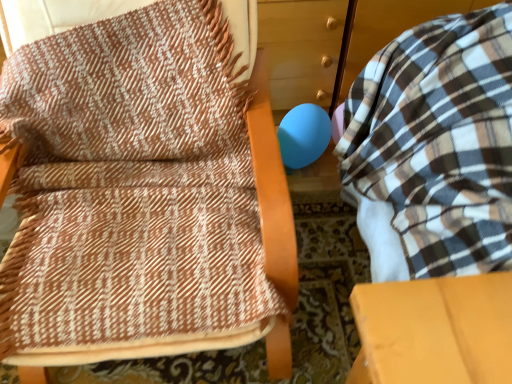
The width and height of the screenshot is (512, 384). Identify the location of matte blue balloon at center. (303, 135).

Identify the location of brown woven blanket at upper left. (143, 193).

Image resolution: width=512 pixels, height=384 pixels. What do you see at coordinates (143, 193) in the screenshot?
I see `brown woven blanket at upper left` at bounding box center [143, 193].

Where is `matte blue balloon at center`? Image resolution: width=512 pixels, height=384 pixels. matte blue balloon at center is located at coordinates (303, 135).

Can you tell me how much brown woven blanket at upper left and plaid fabric bean bag at right differ in facing direction?

The angle between the facing direction of brown woven blanket at upper left and the facing direction of plaid fabric bean bag at right is 90.4 degrees.

Does brown woven blanket at upper left appear on the left side of plaid fabric bean bag at right?

Correct, you'll find brown woven blanket at upper left to the left of plaid fabric bean bag at right.

Is brown woven blanket at upper left aimed at plaid fabric bean bag at right?

No.

In the scene shown: Is brown woven blanket at upper left far from matte blue balloon at center?

No, brown woven blanket at upper left is in close proximity to matte blue balloon at center.

Which object is positioned more to the right, brown woven blanket at upper left or matte blue balloon at center?

From the viewer's perspective, matte blue balloon at center appears more on the right side.

Is brown woven blanket at upper left oriented away from matte blue balloon at center?

No, brown woven blanket at upper left is not facing the opposite direction of matte blue balloon at center.

The image size is (512, 384). I want to click on balloon on the left of plaid fabric bean bag at right, so click(x=303, y=135).

Which object is positioned more to the left, matte blue balloon at center or plaid fabric bean bag at right?

From the viewer's perspective, matte blue balloon at center appears more on the left side.

Considering the relative sizes of matte blue balloon at center and plaid fabric bean bag at right in the image provided, is matte blue balloon at center wider than plaid fabric bean bag at right?

Incorrect, the width of matte blue balloon at center does not surpass that of plaid fabric bean bag at right.

Does matte blue balloon at center touch plaid fabric bean bag at right?

There is a gap between matte blue balloon at center and plaid fabric bean bag at right.

Is plaid fabric bean bag at right to the right of brown woven blanket at upper left from the viewer's perspective?

Yes, plaid fabric bean bag at right is to the right of brown woven blanket at upper left.

Considering the sizes of objects plaid fabric bean bag at right and brown woven blanket at upper left in the image provided, who is smaller, plaid fabric bean bag at right or brown woven blanket at upper left?

Smaller between the two is brown woven blanket at upper left.

From the image's perspective, does plaid fabric bean bag at right appear higher than brown woven blanket at upper left?

Actually, plaid fabric bean bag at right appears below brown woven blanket at upper left in the image.

Which is behind, point (423, 29) or point (236, 291)?

The point (423, 29) is more distant.

Are plaid fabric bean bag at right and matte blue balloon at center located far from each other?

That's not correct — plaid fabric bean bag at right is a little close to matte blue balloon at center.

What's the angular difference between plaid fabric bean bag at right and matte blue balloon at center's facing directions?

The angle between the facing direction of plaid fabric bean bag at right and the facing direction of matte blue balloon at center is 92.5 degrees.

Find the location of a particular element. This screenshot has width=512, height=384. bean bag chair above the matte blue balloon at center (from a real-world perspective) is located at coordinates (434, 148).

In the scene shown: How much distance is there between plaid fabric bean bag at right and matte blue balloon at center?

They are 22.24 inches apart.

Is matte blue balloon at center bigger than brown woven blanket at upper left?

Incorrect, matte blue balloon at center is not larger than brown woven blanket at upper left.

Consider the image. Which object is positioned more to the left, matte blue balloon at center or brown woven blanket at upper left?

From the viewer's perspective, brown woven blanket at upper left appears more on the left side.

Is matte blue balloon at center shorter than brown woven blanket at upper left?

Yes, matte blue balloon at center is shorter than brown woven blanket at upper left.

Looking at this image, is matte blue balloon at center behind brown woven blanket at upper left?

Yes, matte blue balloon at center is further from the camera.

The height and width of the screenshot is (384, 512). Find the location of `bean bag chair that is below the brown woven blanket at upper left (from the image's perspective)`. bean bag chair that is below the brown woven blanket at upper left (from the image's perspective) is located at coordinates (434, 148).

The width and height of the screenshot is (512, 384). I want to click on furniture to the left of matte blue balloon at center, so click(143, 193).

Looking at the image, which one is located further to matte blue balloon at center, plaid fabric bean bag at right or brown woven blanket at upper left?

brown woven blanket at upper left is further to matte blue balloon at center.

Estimate the real-world distances between objects in this image. Which object is further from plaid fabric bean bag at right, matte blue balloon at center or brown woven blanket at upper left?

Based on the image, matte blue balloon at center appears to be further to plaid fabric bean bag at right.

When comparing their distances from plaid fabric bean bag at right, does brown woven blanket at upper left or matte blue balloon at center seem further?

matte blue balloon at center lies further to plaid fabric bean bag at right than the other object.

When comparing their distances from brown woven blanket at upper left, does plaid fabric bean bag at right or matte blue balloon at center seem closer?

plaid fabric bean bag at right is closer to brown woven blanket at upper left.

Estimate the real-world distances between objects in this image. Which object is further from brown woven blanket at upper left, matte blue balloon at center or plaid fabric bean bag at right?

Based on the image, matte blue balloon at center appears to be further to brown woven blanket at upper left.

Looking at the image, which one is located closer to matte blue balloon at center, brown woven blanket at upper left or plaid fabric bean bag at right?

plaid fabric bean bag at right is positioned closer to the anchor matte blue balloon at center.

Find the location of a particular element. The height and width of the screenshot is (384, 512). furniture positioned between plaid fabric bean bag at right and matte blue balloon at center from near to far is located at coordinates (143, 193).